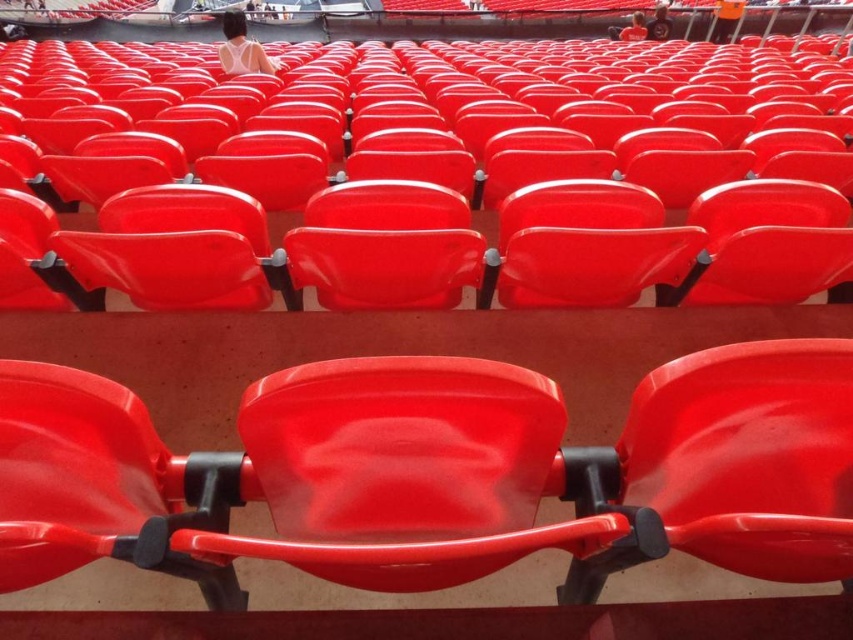
Question: Among these objects, which one is farthest from the camera?

Choices:
 (A) matte white tank top at upper center
 (B) matte plastic seat at center

Answer: (A)

Question: Which object is the closest to the matte white shirt at upper center?

Choices:
 (A) matte plastic seat at center
 (B) matte white tank top at upper center

Answer: (B)

Question: Is the position of matte plastic seat at center less distant than that of matte white shirt at upper center?

Choices:
 (A) no
 (B) yes

Answer: (B)

Question: From the image, what is the correct spatial relationship of matte plastic seat at center in relation to matte white tank top at upper center?

Choices:
 (A) left
 (B) right

Answer: (B)

Question: Does matte plastic seat at center appear over matte white shirt at upper center?

Choices:
 (A) yes
 (B) no

Answer: (B)

Question: Considering the real-world distances, which object is farthest from the matte plastic seat at center?

Choices:
 (A) matte white shirt at upper center
 (B) matte white tank top at upper center

Answer: (A)